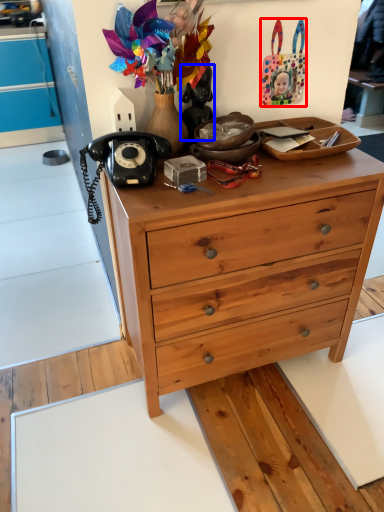
Question: Which of the following is the farthest to the observer, handbag (highlighted by a red box) or person (highlighted by a blue box)?

Choices:
 (A) handbag
 (B) person

Answer: (A)